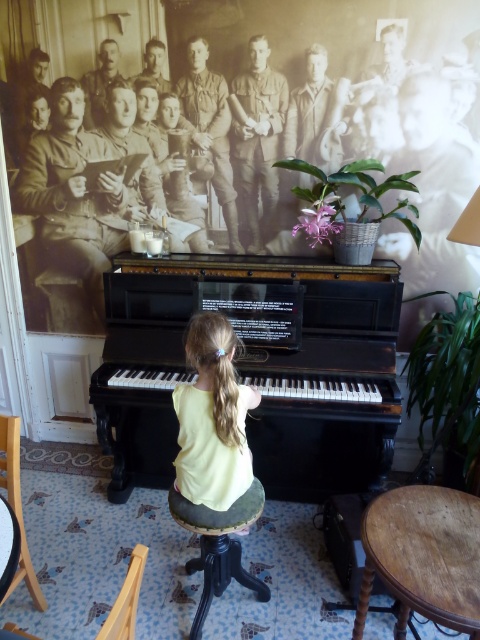
Question: Which object is the closest to the wooden chair at lower left?

Choices:
 (A) yellow cotton shirt at center
 (B) dark wood stool at center
 (C) black polished piano at center
 (D) wooden at lower left

Answer: (B)

Question: Does black polished piano at center have a smaller size compared to dark wood stool at center?

Choices:
 (A) no
 (B) yes

Answer: (A)

Question: Does dark wood stool at center appear on the left side of wooden chair at lower left?

Choices:
 (A) yes
 (B) no

Answer: (B)

Question: Which point is closer to the camera?

Choices:
 (A) (254, 486)
 (B) (291, 481)
 (C) (200, 314)
 (D) (124, 621)

Answer: (D)

Question: Which object is closer to the camera taking this photo?

Choices:
 (A) wooden chair at lower left
 (B) wooden at lower left
 (C) yellow cotton shirt at center

Answer: (B)

Question: Is black polished piano at center positioned before yellow cotton shirt at center?

Choices:
 (A) no
 (B) yes

Answer: (A)